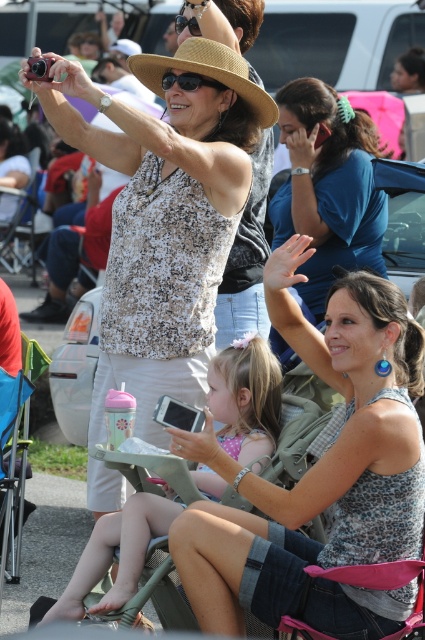
You are standing at the point labeled point (340, 115) and want to walk to the point labeled point (172, 84). Which direction should you move to get closer to your destination?

You should move forward because point (340, 115) is further to the viewer than point (172, 84), so moving forward will bring you closer to the destination.

You are standing at the position of the camera operator holding the camera. You want to hand the matte blue shirt at center to someone who is 10 meters away from you. Can you reach them directly without moving from your current position?

The matte blue shirt at center is 8.93 meters away from the camera. Since you are at the camera position, the shirt is 8.93 meters away from you. To reach someone 10 meters away, the shirt would need to be at least 10 meters away. Since it is closer, you cannot reach the person 10 meters away directly without moving.